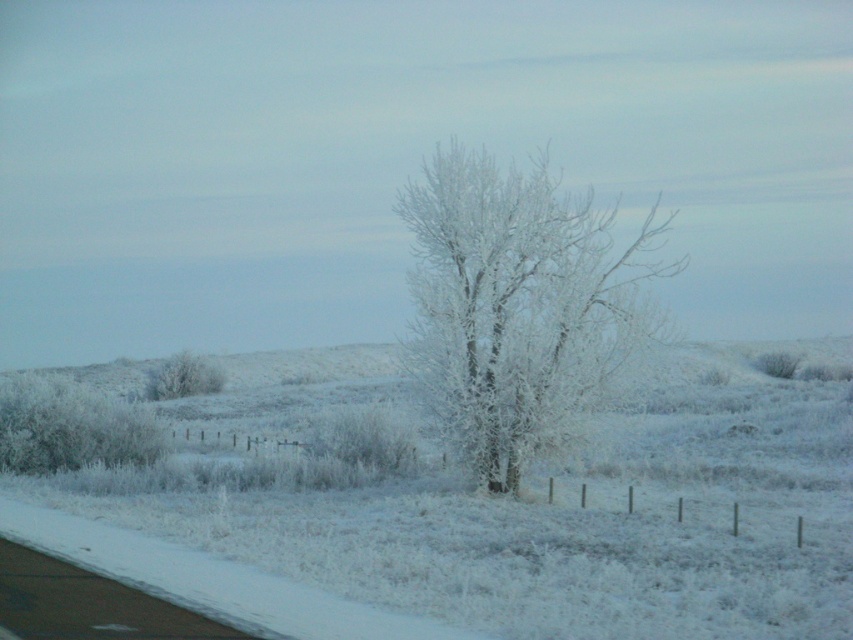
Which is in front, point (167, 490) or point (192, 390)?

Point (167, 490) is more forward.

Who is more distant from viewer, (454, 516) or (184, 364)?

The point (184, 364) is behind.

At what (x,y) coordinates should I click in order to perform the action: click on white frosty tree at center. Please return your answer as a coordinate pair (x, y). Image resolution: width=853 pixels, height=640 pixels. Looking at the image, I should click on (531, 500).

Does white frosty tree at center have a lesser width compared to frosted white tree at center?

No.

The width and height of the screenshot is (853, 640). I want to click on white frosty tree at center, so click(x=531, y=500).

Based on the photo, is frosted white tree at center wider than frosted white tree at left?

Indeed, frosted white tree at center has a greater width compared to frosted white tree at left.

Is frosted white tree at center in front of frosted white tree at left?

Yes, frosted white tree at center is in front of frosted white tree at left.

Is point (451, 378) positioned in front of point (215, 388)?

That is True.

The height and width of the screenshot is (640, 853). I want to click on frosted white tree at center, so click(515, 305).